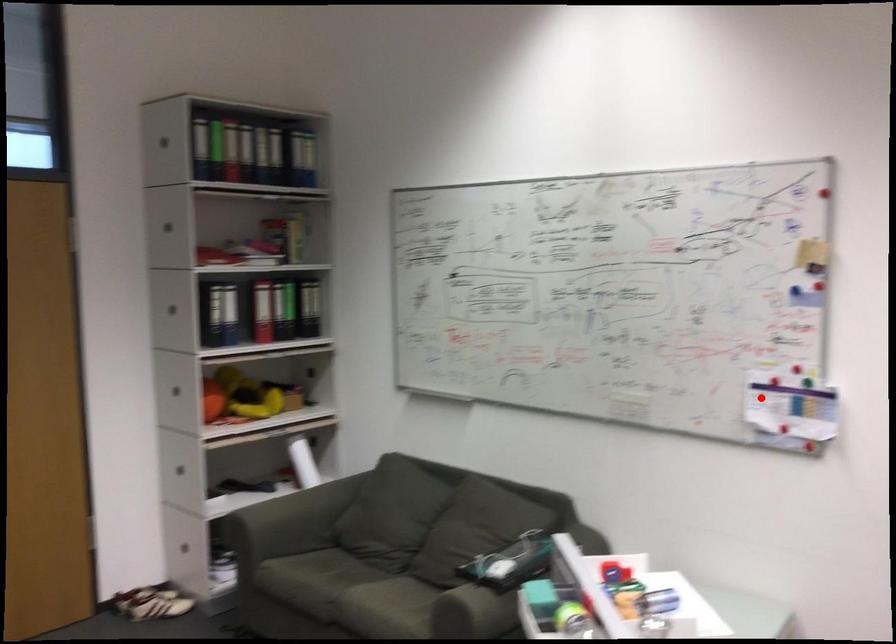
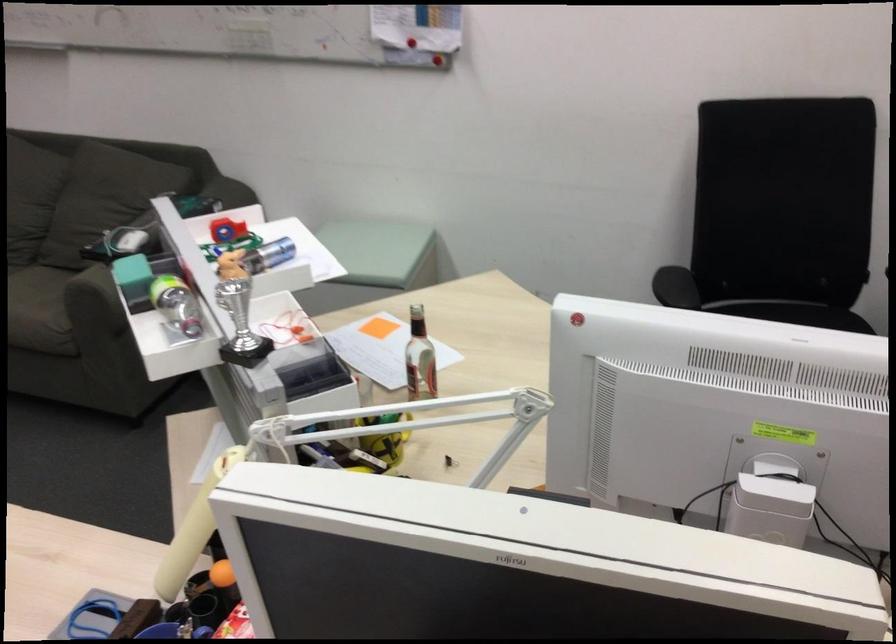
Where in the second image is the point corresponding to the highlighted location from the first image?

(401, 13)